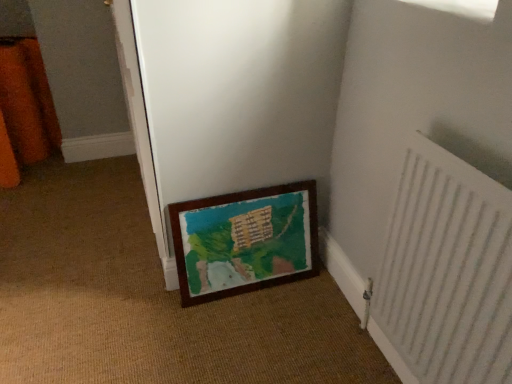
Question: Is point (437, 279) closer or farther from the camera than point (224, 203)?

Choices:
 (A) farther
 (B) closer

Answer: (B)

Question: From their relative heights in the image, would you say white textured radiator at lower right is taller or shorter than wooden frame at lower center?

Choices:
 (A) tall
 (B) short

Answer: (A)

Question: Based on their relative distances, which object is nearer to the white textured radiator at lower right?

Choices:
 (A) wooden frame at lower center
 (B) wooden frame at lower center

Answer: (B)

Question: Considering the real-world distances, which object is farthest from the white textured radiator at lower right?

Choices:
 (A) wooden frame at lower center
 (B) wooden frame at lower center

Answer: (B)